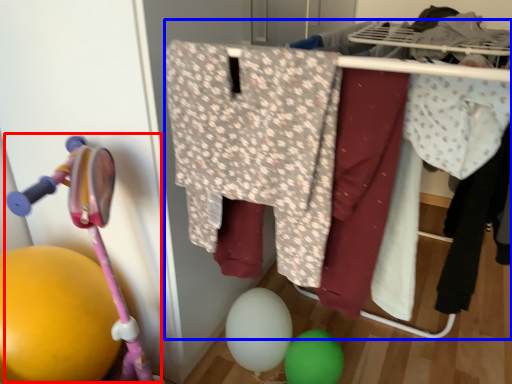
Question: Which object appears closest to the camera in this image, baby carriage (highlighted by a red box) or closet (highlighted by a blue box)?

Choices:
 (A) baby carriage
 (B) closet

Answer: (B)